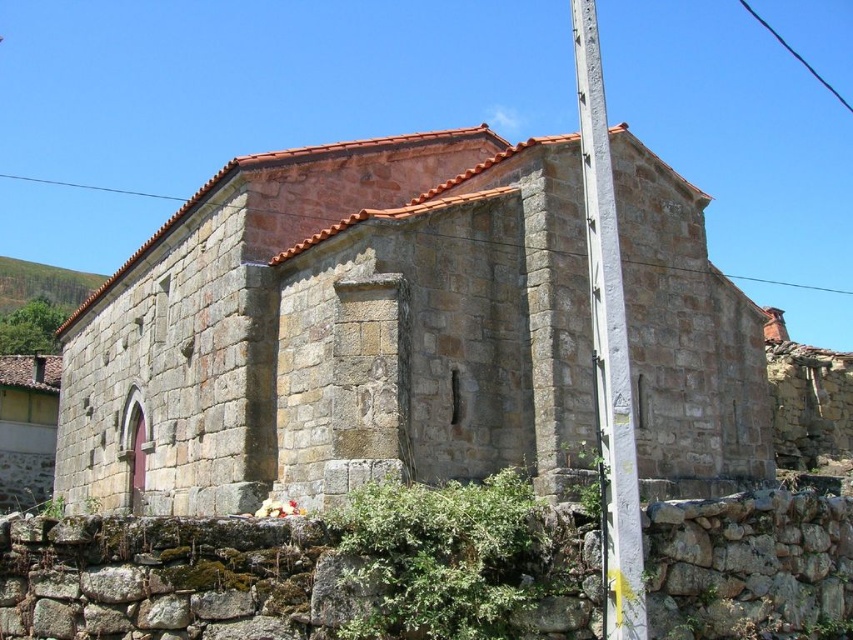
Question: Which object appears closest to the camera in this image?

Choices:
 (A) white painted metal pole at right
 (B) stone chapel at center

Answer: (A)

Question: Does stone chapel at center come behind white painted metal pole at right?

Choices:
 (A) no
 (B) yes

Answer: (B)

Question: Which object is closer to the camera taking this photo?

Choices:
 (A) white painted metal pole at right
 (B) stone chapel at center

Answer: (A)

Question: Does stone chapel at center appear under white painted metal pole at right?

Choices:
 (A) yes
 (B) no

Answer: (A)

Question: Which point is closer to the camera taking this photo?

Choices:
 (A) (650, 467)
 (B) (595, 44)

Answer: (B)

Question: Does stone chapel at center have a greater width compared to white painted metal pole at right?

Choices:
 (A) no
 (B) yes

Answer: (B)